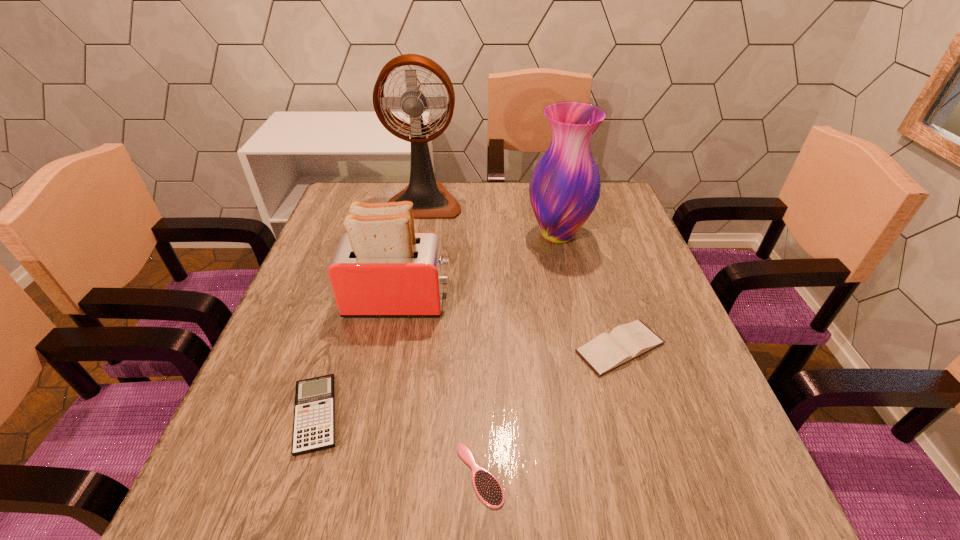
Locate an element on the screen. vase situated at the right edge is located at coordinates (564, 189).

Locate an element on the screen. This screenshot has height=540, width=960. diary located in the right edge section of the desktop is located at coordinates (624, 343).

At what (x,y) coordinates should I click in order to perform the action: click on object positioned at the far left corner. Please return your answer as a coordinate pair (x, y). The height and width of the screenshot is (540, 960). Looking at the image, I should click on (430, 199).

Locate an element on the screen. Image resolution: width=960 pixels, height=540 pixels. object positioned at the far right corner is located at coordinates (564, 189).

The height and width of the screenshot is (540, 960). I want to click on vacant region at the far edge of the desktop, so click(x=464, y=204).

Image resolution: width=960 pixels, height=540 pixels. I want to click on free space at the near edge, so click(418, 483).

Where is `vacant space at the left edge`? Image resolution: width=960 pixels, height=540 pixels. vacant space at the left edge is located at coordinates (346, 337).

You are a GUI agent. You are given a task and a screenshot of the screen. Output one action in this format:
    pyautogui.click(x=<x>, y=<y>)
    Task: Click on the vacant space at the right edge
    The width and height of the screenshot is (960, 540).
    Given the screenshot: What is the action you would take?
    pyautogui.click(x=641, y=273)

In the image, there is a desktop. Identify the location of free space at the far left corner. (327, 216).

This screenshot has height=540, width=960. In order to click on vacant space that is in between the fourth farthest object and the calculator in this screenshot , I will do coord(468,381).